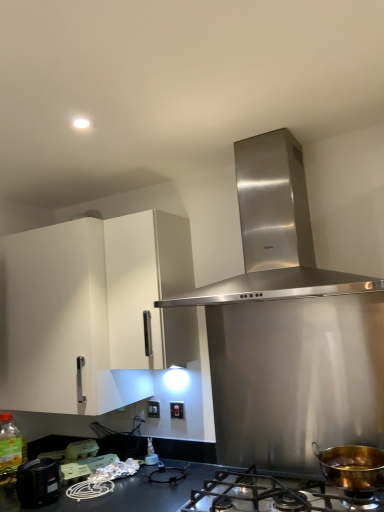
Question: Does translucent plastic bottle at center, the second bottle viewed from the left, have a lesser width compared to white matte cabinet at upper left?

Choices:
 (A) yes
 (B) no

Answer: (A)

Question: Can you confirm if translucent plastic bottle at center, the second bottle viewed from the left, is bigger than white matte cabinet at upper left?

Choices:
 (A) no
 (B) yes

Answer: (A)

Question: From a real-world perspective, does translucent plastic bottle at center, the second bottle viewed from the left, sit lower than white matte cabinet at upper left?

Choices:
 (A) no
 (B) yes

Answer: (B)

Question: Can you confirm if translucent plastic bottle at center, the second bottle viewed from the left, is positioned to the left of white matte cabinet at upper left?

Choices:
 (A) yes
 (B) no

Answer: (B)

Question: Can you confirm if translucent plastic bottle at center, the second bottle viewed from the left, is taller than white matte cabinet at upper left?

Choices:
 (A) no
 (B) yes

Answer: (A)

Question: Is translucent plastic bottle at center, the second bottle viewed from the left, smaller than white matte cabinet at upper left?

Choices:
 (A) no
 (B) yes

Answer: (B)

Question: Is white plastic electric outlet at center, acting as the 2th electric outlet starting from the front, completely or partially outside of matte plastic container at lower left, acting as the second appliance starting from the front?

Choices:
 (A) yes
 (B) no

Answer: (A)

Question: Can you confirm if white plastic electric outlet at center, which appears as the 2th electric outlet when viewed from the right, is wider than matte plastic container at lower left, acting as the second appliance starting from the front?

Choices:
 (A) no
 (B) yes

Answer: (A)

Question: From a real-world perspective, is white plastic electric outlet at center, the first electric outlet from the left, over matte plastic container at lower left, which is the second appliance from back to front?

Choices:
 (A) yes
 (B) no

Answer: (A)

Question: Does white plastic electric outlet at center, which appears as the 2th electric outlet when viewed from the right, come behind matte plastic container at lower left, which is the second appliance from back to front?

Choices:
 (A) no
 (B) yes

Answer: (B)

Question: Is white plastic electric outlet at center, the first electric outlet from the left, thinner than matte plastic container at lower left, which is the second appliance from back to front?

Choices:
 (A) no
 (B) yes

Answer: (B)

Question: Is white plastic electric outlet at center, acting as the 2th electric outlet starting from the front, aimed at matte plastic container at lower left, acting as the second appliance starting from the front?

Choices:
 (A) yes
 (B) no

Answer: (B)

Question: Is translucent plastic bottle at lower left, placed as the 2th bottle when sorted from right to left, not within matte black switch at center, the 2th electric outlet from the left?

Choices:
 (A) no
 (B) yes

Answer: (B)